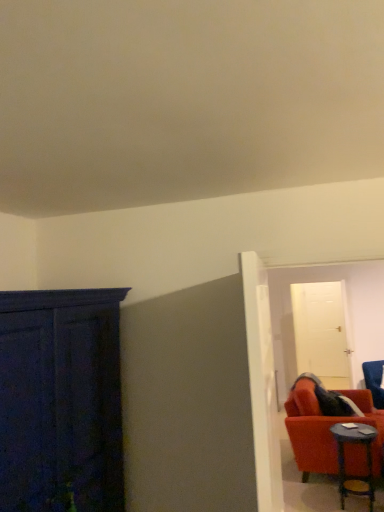
Question: Is white glossy door at upper right, which ranks as the 1th door in back-to-front order, in front of or behind velvet blue armchair at right in the image?

Choices:
 (A) behind
 (B) front

Answer: (A)

Question: From a real-world perspective, is white glossy door at upper right, which is the 2th door from front to back, physically located above or below velvet blue armchair at right?

Choices:
 (A) below
 (B) above

Answer: (B)

Question: Which object is positioned closest to the velvet blue armchair at right?

Choices:
 (A) wooden round table at lower right
 (B) white glossy door at center, the 1th door viewed from the left
 (C) white glossy door at upper right, which is the 2th door from front to back

Answer: (C)

Question: Based on their relative distances, which object is nearer to the velvet blue armchair at right?

Choices:
 (A) wooden round table at lower right
 (B) white glossy door at center, the 1th door viewed from the left
 (C) white glossy door at upper right, positioned as the 1th door in right-to-left order

Answer: (C)